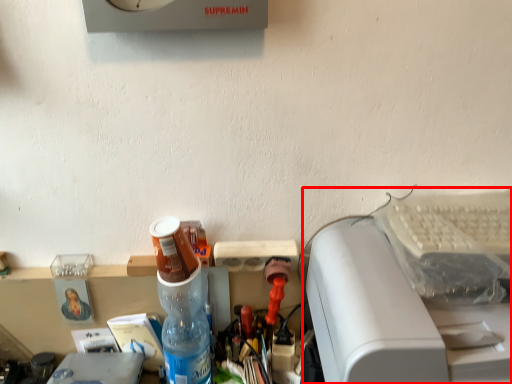
Question: In this image, where is printer (annotated by the red box) located relative to bottle?

Choices:
 (A) right
 (B) left

Answer: (A)